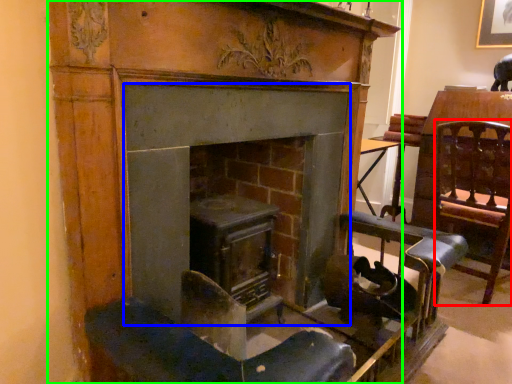
Question: Based on their relative distances, which object is nearer to swivel chair (highlighted by a red box)? Choose from fireplace (highlighted by a blue box) and fireplace (highlighted by a green box).

Choices:
 (A) fireplace
 (B) fireplace

Answer: (B)